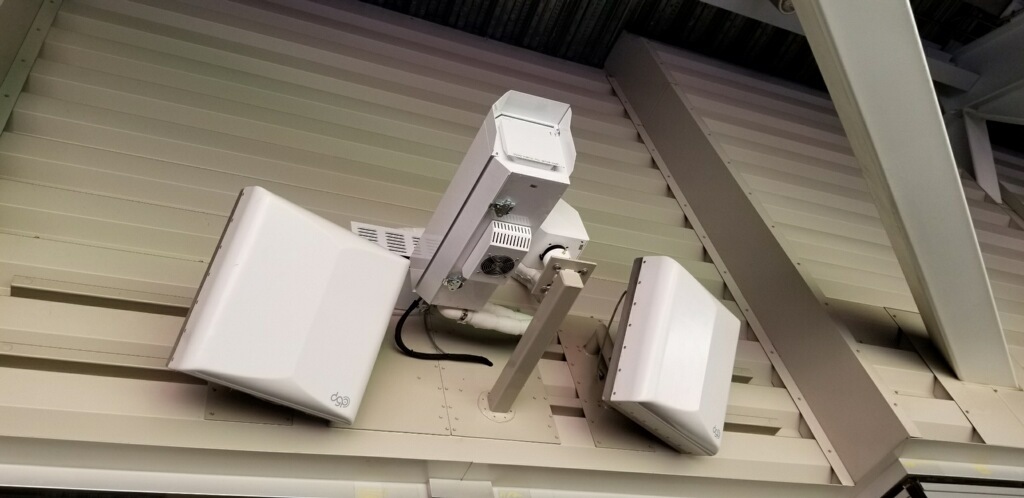
At what (x,y) coordinates should I click in order to perform the action: click on camera holder. Please return your answer as a coordinate pair (x, y). This screenshot has width=1024, height=498. Looking at the image, I should click on (543, 315).